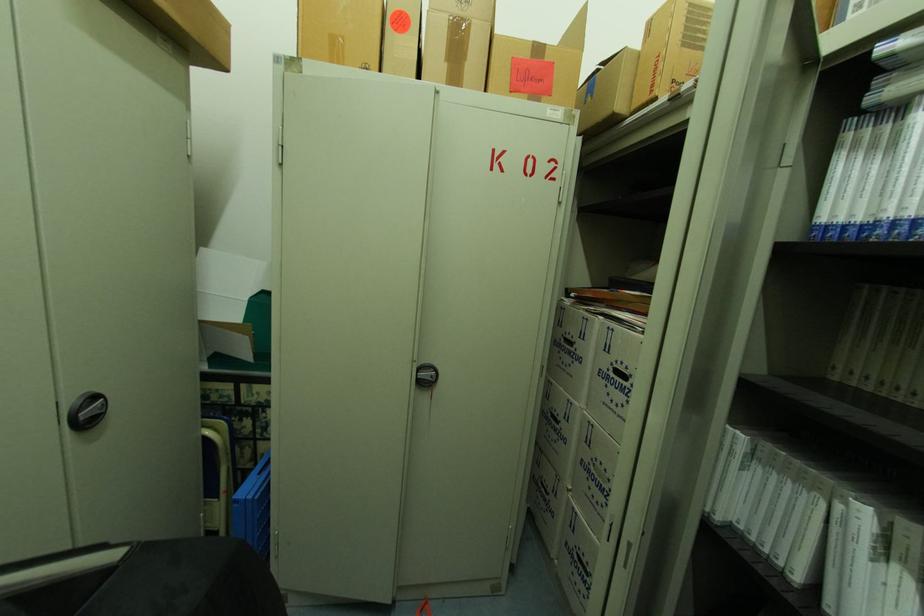
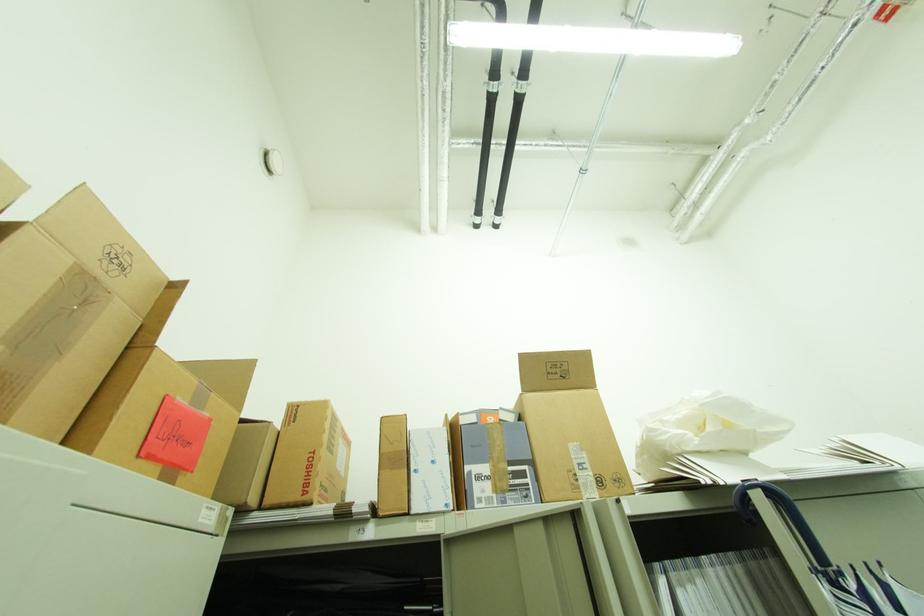
The first image is from the beginning of the video and the second image is from the end. How did the camera likely rotate when shooting the video?

The camera rotated toward right-up.